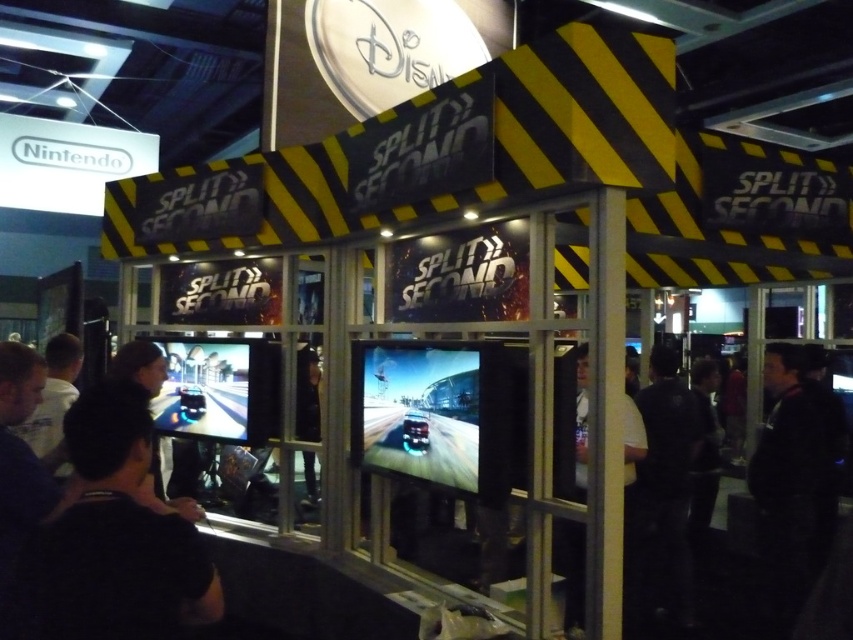
Between black matte shirt at lower left and black fabric jacket at right, which one has less height?

With less height is black matte shirt at lower left.

This screenshot has height=640, width=853. Describe the element at coordinates (114, 538) in the screenshot. I see `black matte shirt at lower left` at that location.

Find the location of a particular element. This screenshot has height=640, width=853. black matte shirt at lower left is located at coordinates (114, 538).

Is black matte shirt at lower left shorter than dark hair at lower left?

Indeed, black matte shirt at lower left has a lesser height compared to dark hair at lower left.

Who is positioned more to the left, black matte shirt at lower left or dark hair at lower left?

dark hair at lower left

At what (x,y) coordinates should I click in order to perform the action: click on black matte shirt at lower left. Please return your answer as a coordinate pair (x, y). This screenshot has height=640, width=853. Looking at the image, I should click on (114, 538).

Can you confirm if black fabric at right is positioned to the left of dark hair at lower left?

Incorrect, black fabric at right is not on the left side of dark hair at lower left.

In the scene shown: Can you confirm if black fabric at right is positioned to the right of dark hair at lower left?

Yes, black fabric at right is to the right of dark hair at lower left.

Image resolution: width=853 pixels, height=640 pixels. Describe the element at coordinates (664, 484) in the screenshot. I see `black fabric at right` at that location.

Where is `black fabric at right`? This screenshot has height=640, width=853. black fabric at right is located at coordinates (664, 484).